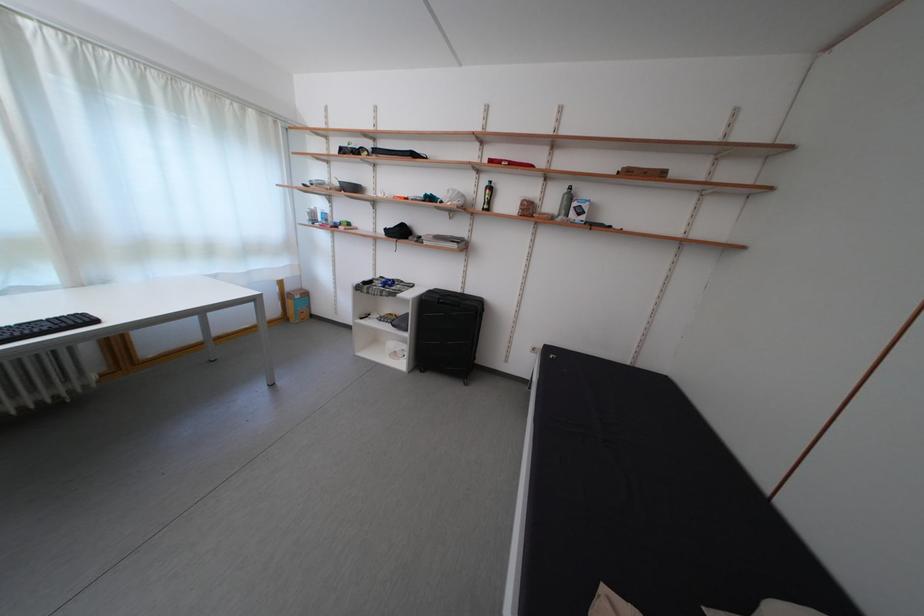
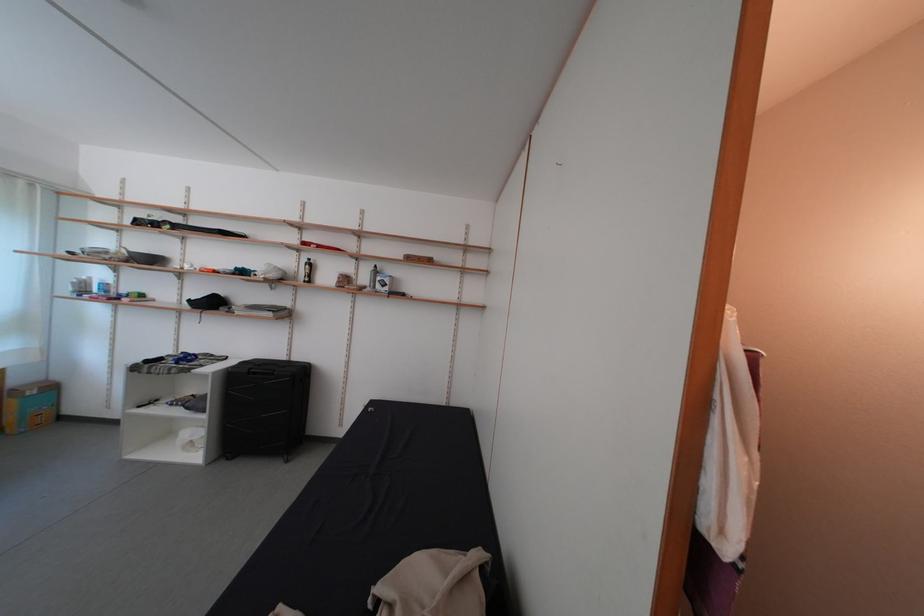
In a continuous first-person perspective shot, in which direction is the camera moving?

The cameraman moved toward right, backward.